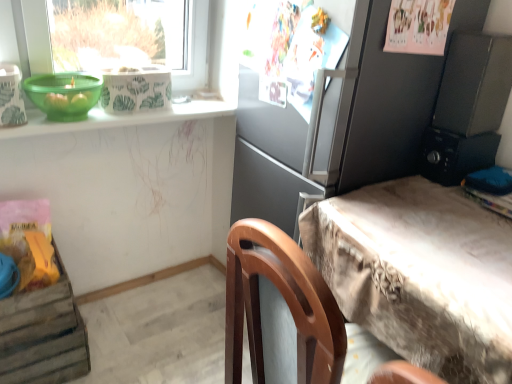
This screenshot has width=512, height=384. I want to click on vacant space in front of black plastic radio at upper right, so click(449, 200).